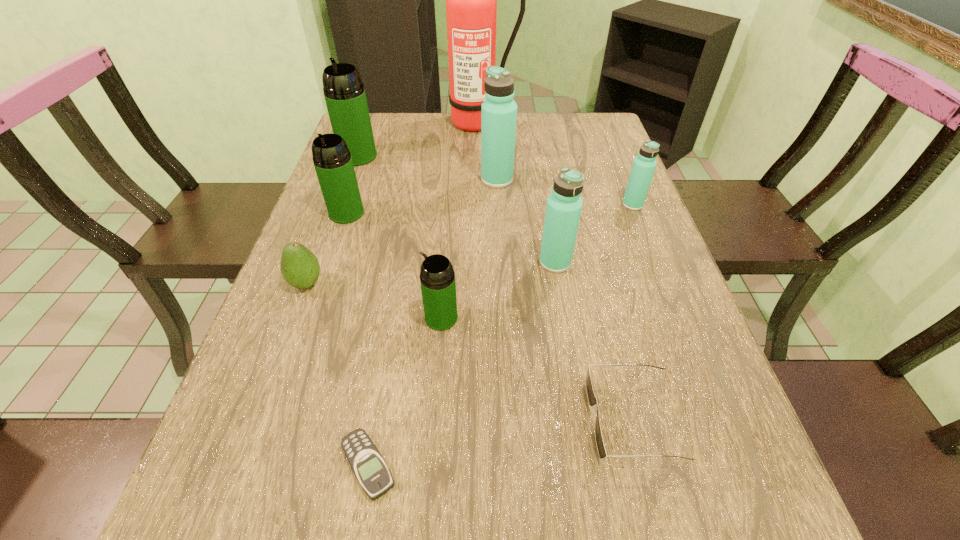
Image resolution: width=960 pixels, height=540 pixels. Find the location of `vacant space at the right edge of the desktop`. vacant space at the right edge of the desktop is located at coordinates point(636,338).

This screenshot has height=540, width=960. What are the coordinates of `vacant space in between the gray beeper and the nearest thermos bottle` in the screenshot? It's located at (405, 392).

Locate an element on the screen. Image resolution: width=960 pixels, height=540 pixels. vacant point located between the rightmost green thermos bottle and the fire extinguisher is located at coordinates click(x=460, y=220).

Image resolution: width=960 pixels, height=540 pixels. Find the location of `unoccupied area between the second biggest aqua thermos bottle and the eighth farthest object`. unoccupied area between the second biggest aqua thermos bottle and the eighth farthest object is located at coordinates (498, 290).

You are a GUI agent. You are given a task and a screenshot of the screen. Output one action in this format:
    pyautogui.click(x=<x>, y=<y>)
    Task: Click on the vacant space in between the third thermos bottle from right to left and the nearest aqua thermos bottle
    Image resolution: width=960 pixels, height=540 pixels.
    Given the screenshot: What is the action you would take?
    pyautogui.click(x=526, y=221)

This screenshot has width=960, height=540. What are the coordinates of `vacant space that is in between the biggest green thermos bottle and the tallest object` in the screenshot? It's located at (418, 140).

At what (x,y) coordinates should I click in order to perform the action: click on vacant area that lies between the second farthest green thermos bottle and the red fire extinguisher. Please return your answer as a coordinate pair (x, y). This screenshot has width=960, height=540. Looking at the image, I should click on (412, 168).

Locate an element on the screen. free space between the farthest green thermos bottle and the nearest thermos bottle is located at coordinates (400, 237).

Locate an element on the screen. vacant region between the farthest green thermos bottle and the second biggest aqua thermos bottle is located at coordinates (457, 210).

Find the location of a particular element. The height and width of the screenshot is (540, 960). object that is the fourth closest to the leftmost aqua thermos bottle is located at coordinates (332, 160).